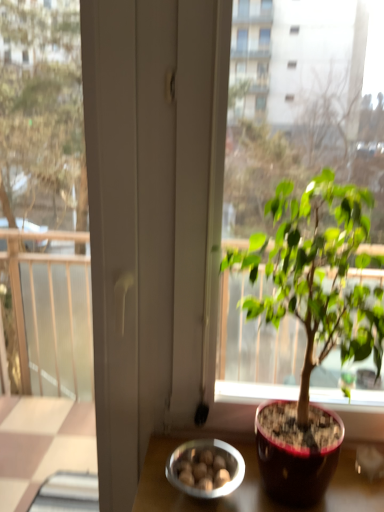
Question: Can you confirm if green glossy houseplant at center is bigger than metallic silver bowl at lower center?

Choices:
 (A) yes
 (B) no

Answer: (A)

Question: Is green glossy houseplant at center shorter than metallic silver bowl at lower center?

Choices:
 (A) yes
 (B) no

Answer: (B)

Question: From the image's perspective, is green glossy houseplant at center located beneath metallic silver bowl at lower center?

Choices:
 (A) no
 (B) yes

Answer: (A)

Question: Can you confirm if green glossy houseplant at center is wider than metallic silver bowl at lower center?

Choices:
 (A) yes
 (B) no

Answer: (A)

Question: Considering the relative sizes of green glossy houseplant at center and metallic silver bowl at lower center in the image provided, is green glossy houseplant at center taller than metallic silver bowl at lower center?

Choices:
 (A) no
 (B) yes

Answer: (B)

Question: Is green glossy houseplant at center behind metallic silver bowl at lower center?

Choices:
 (A) yes
 (B) no

Answer: (B)

Question: From a real-world perspective, is metallic silver bowl at lower center physically above green glossy houseplant at center?

Choices:
 (A) yes
 (B) no

Answer: (B)

Question: Is metallic silver bowl at lower center to the left of green glossy houseplant at center from the viewer's perspective?

Choices:
 (A) yes
 (B) no

Answer: (A)

Question: Is metallic silver bowl at lower center smaller than green glossy houseplant at center?

Choices:
 (A) yes
 (B) no

Answer: (A)

Question: Is metallic silver bowl at lower center oriented away from green glossy houseplant at center?

Choices:
 (A) no
 (B) yes

Answer: (A)

Question: Does metallic silver bowl at lower center appear on the right side of green glossy houseplant at center?

Choices:
 (A) no
 (B) yes

Answer: (A)

Question: From the image's perspective, would you say metallic silver bowl at lower center is shown under green glossy houseplant at center?

Choices:
 (A) no
 (B) yes

Answer: (B)

Question: Is point (379, 352) positioned closer to the camera than point (185, 444)?

Choices:
 (A) farther
 (B) closer

Answer: (B)